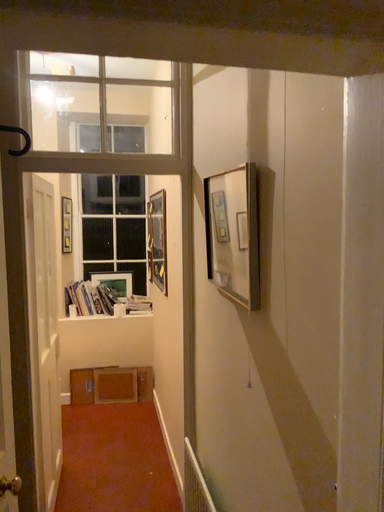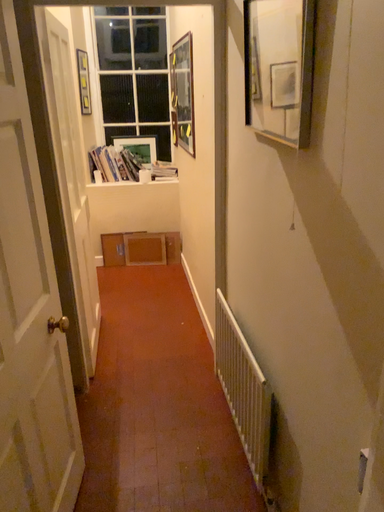
Question: How did the camera likely rotate when shooting the video?

Choices:
 (A) rotated upward
 (B) rotated downward

Answer: (B)